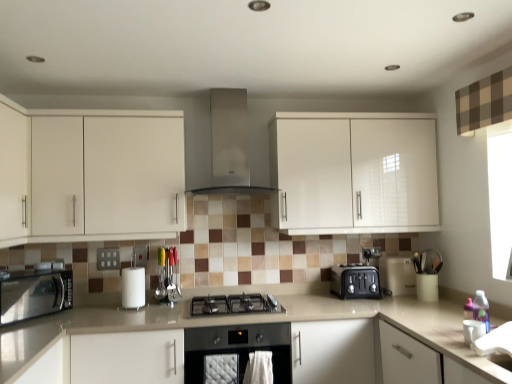
Identify the location of black plastic toaster at right. (397, 275).

At what (x,y) coordinates should I click in order to perform the action: click on beige laminate countertop at center. Please return your answer as a coordinate pair (x, y). Looking at the image, I should click on (251, 322).

Locate an element on the screen. The image size is (512, 384). white matte paper towel at center is located at coordinates (133, 287).

Measure the distance between point (377, 279) and camera.

The distance of point (377, 279) from camera is 9.56 feet.

Where is `satin silver range hood at center, arranged as the first home appliance when viewed from the top`? Image resolution: width=512 pixels, height=384 pixels. satin silver range hood at center, arranged as the first home appliance when viewed from the top is located at coordinates (230, 144).

Looking at this image, considering the relative positions of white glossy cabinet at upper left, the 2th cabinetry from the right, and black stainless steel microwave at lower left, the second kitchen appliance viewed from the right, in the image provided, is white glossy cabinet at upper left, the 2th cabinetry from the right, behind black stainless steel microwave at lower left, the second kitchen appliance viewed from the right,?

That is True.

Image resolution: width=512 pixels, height=384 pixels. In order to click on cabinetry that is the 2nd object above the black stainless steel microwave at lower left, which ranks as the 1th kitchen appliance in left-to-right order (from a real-world perspective) in this screenshot , I will do `click(95, 174)`.

Consider the image. Is white glossy cabinet at upper left, the 2th cabinetry from the right, at the right side of black stainless steel microwave at lower left, which ranks as the second kitchen appliance in back-to-front order?

Correct, you'll find white glossy cabinet at upper left, the 2th cabinetry from the right, to the right of black stainless steel microwave at lower left, which ranks as the second kitchen appliance in back-to-front order.

Looking at this image, from the image's perspective, which object appears higher, white glossy cabinet at upper left, the 2th cabinetry from the right, or black stainless steel microwave at lower left, the 1th kitchen appliance positioned from the front?

From the image's view, white glossy cabinet at upper left, the 2th cabinetry from the right, is above.

From a real-world perspective, which is physically above, stainless steel oven at center, the second home appliance viewed from the top, or satin silver range hood at center, arranged as the first home appliance when viewed from the top?

satin silver range hood at center, arranged as the first home appliance when viewed from the top.

Which of these two, stainless steel oven at center, the second home appliance viewed from the top, or satin silver range hood at center, arranged as the first home appliance when viewed from the top, is wider?

Wider between the two is stainless steel oven at center, the second home appliance viewed from the top.

Considering the positions of objects stainless steel oven at center, the first home appliance ordered from the bottom, and satin silver range hood at center, arranged as the first home appliance when viewed from the top, in the image provided, who is behind, stainless steel oven at center, the first home appliance ordered from the bottom, or satin silver range hood at center, arranged as the first home appliance when viewed from the top,?

satin silver range hood at center, arranged as the first home appliance when viewed from the top, is further away from the camera.

Is point (280, 380) closer or farther from the camera than point (236, 114)?

Clearly, point (280, 380) is closer to the camera than point (236, 114).

Choose the correct answer: Is black plastic toaster at lower center, placed as the 1th kitchen appliance when sorted from right to left, inside brown checkered curtain at upper right or outside it?

black plastic toaster at lower center, placed as the 1th kitchen appliance when sorted from right to left, is outside brown checkered curtain at upper right.

What's the angular difference between black plastic toaster at lower center, placed as the 1th kitchen appliance when sorted from right to left, and brown checkered curtain at upper right's facing directions?

black plastic toaster at lower center, placed as the 1th kitchen appliance when sorted from right to left, and brown checkered curtain at upper right are facing 89.2 degrees away from each other.

From a real-world perspective, which is physically below, black plastic toaster at lower center, placed as the 1th kitchen appliance when sorted from right to left, or brown checkered curtain at upper right?

black plastic toaster at lower center, placed as the 1th kitchen appliance when sorted from right to left.

From a real-world perspective, count 2nd kitchen appliances downward from the brown checkered curtain at upper right and point to it. Please provide its 2D coordinates.

[(355, 282)]

Is brown checkered curtain at upper right outside of satin silver range hood at center, arranged as the first home appliance when viewed from the top?

That's correct, brown checkered curtain at upper right is outside of satin silver range hood at center, arranged as the first home appliance when viewed from the top.

In the scene shown: Is brown checkered curtain at upper right behind satin silver range hood at center, which is the second home appliance in bottom-to-top order?

No, brown checkered curtain at upper right is closer to the viewer.

You are a GUI agent. You are given a task and a screenshot of the screen. Output one action in this format:
    pyautogui.click(x=<x>, y=<y>)
    Task: Click on the 1st home appliance below when counting from the brown checkered curtain at upper right (from the image's perspective)
    The height and width of the screenshot is (384, 512).
    Given the screenshot: What is the action you would take?
    230,144

Is satin silver range hood at center, which is the second home appliance in bottom-to-top order, at the back of brown checkered curtain at upper right?

No, satin silver range hood at center, which is the second home appliance in bottom-to-top order, is not at the back of brown checkered curtain at upper right.

Choose the correct answer: Is matte white switch at center inside white matte paper towel at center or outside it?

matte white switch at center is spatially situated outside white matte paper towel at center.

Which object is further away from the camera taking this photo, matte white switch at center or white matte paper towel at center?

matte white switch at center is more distant.

From a real-world perspective, is matte white switch at center located beneath white matte paper towel at center?

No, from a real-world perspective, matte white switch at center is not below white matte paper towel at center.

Locate an element on the screen. square above the white matte paper towel at center (from the image's perspective) is located at coordinates (108, 259).

Is white glossy cabinet at upper left, the first cabinetry when ordered from left to right, turned away from brown checkered curtain at upper right?

No.

Who is smaller, white glossy cabinet at upper left, the first cabinetry when ordered from left to right, or brown checkered curtain at upper right?

brown checkered curtain at upper right is smaller.

Are white glossy cabinet at upper left, the first cabinetry when ordered from left to right, and brown checkered curtain at upper right located far from each other?

Yes, white glossy cabinet at upper left, the first cabinetry when ordered from left to right, is far from brown checkered curtain at upper right.

Which object is thinner, white glossy cabinet at upper left, the 2th cabinetry from the right, or brown checkered curtain at upper right?

With smaller width is brown checkered curtain at upper right.

Is white matte paper towel at center not within satin silver range hood at center, which is the second home appliance in bottom-to-top order?

Yes, white matte paper towel at center is outside of satin silver range hood at center, which is the second home appliance in bottom-to-top order.

At what (x,y) coordinates should I click in order to perform the action: click on the 1st home appliance in front of the white matte paper towel at center. Please return your answer as a coordinate pair (x, y). Looking at the image, I should click on (230, 144).

From the picture: Who is smaller, white matte paper towel at center or satin silver range hood at center, which is the second home appliance in bottom-to-top order?

Smaller between the two is white matte paper towel at center.

Can you tell me how much white matte paper towel at center and satin silver range hood at center, which is the second home appliance in bottom-to-top order, differ in facing direction?

0.494 degrees.

Where is `the 1st cabinetry above the black stainless steel microwave at lower left, which ranks as the second kitchen appliance in back-to-front order (from the image's perspective)`? The height and width of the screenshot is (384, 512). the 1st cabinetry above the black stainless steel microwave at lower left, which ranks as the second kitchen appliance in back-to-front order (from the image's perspective) is located at coordinates (95, 174).

The width and height of the screenshot is (512, 384). Find the location of `home appliance located behind the stainless steel oven at center, the second home appliance viewed from the top`. home appliance located behind the stainless steel oven at center, the second home appliance viewed from the top is located at coordinates (230, 144).

Based on their spatial positions, is brown checkered curtain at upper right or white glossy cabinet at upper left, the first cabinetry when ordered from left to right, further from beige laminate countertop at center?

The object further to beige laminate countertop at center is brown checkered curtain at upper right.

From the image, which object appears to be farther from white matte paper towel at center, black plastic toaster at right or stainless steel oven at center, the second home appliance viewed from the top?

black plastic toaster at right.

When comparing their distances from brown checkered curtain at upper right, does white glossy cabinet at upper center, which is counted as the 2th cabinetry, starting from the left, or black plastic toaster at right seem closer?

The object closer to brown checkered curtain at upper right is white glossy cabinet at upper center, which is counted as the 2th cabinetry, starting from the left.

Looking at the image, which one is located further to black plastic toaster at right, satin silver range hood at center, arranged as the first home appliance when viewed from the top, or matte white switch at center?

The object further to black plastic toaster at right is matte white switch at center.

Based on their spatial positions, is brown checkered curtain at upper right or black stainless steel gas stove at center closer to matte white switch at center?

black stainless steel gas stove at center.

Consider the image. Considering their positions, is black plastic toaster at lower center, positioned as the 1th kitchen appliance in back-to-front order, positioned further to black stainless steel microwave at lower left, which ranks as the second kitchen appliance in back-to-front order, than white glossy cabinet at upper left, the first cabinetry when ordered from left to right?

black plastic toaster at lower center, positioned as the 1th kitchen appliance in back-to-front order, is further to black stainless steel microwave at lower left, which ranks as the second kitchen appliance in back-to-front order.

Based on their spatial positions, is stainless steel oven at center, the first home appliance ordered from the bottom, or white matte paper towel at center further from black stainless steel microwave at lower left, the 1th kitchen appliance positioned from the front?

The object further to black stainless steel microwave at lower left, the 1th kitchen appliance positioned from the front, is stainless steel oven at center, the first home appliance ordered from the bottom.

Which object lies nearer to the anchor point brown checkered curtain at upper right, white glossy cabinet at upper center, which is counted as the 2th cabinetry, starting from the left, or black plastic toaster at lower center, the second kitchen appliance from the front?

white glossy cabinet at upper center, which is counted as the 2th cabinetry, starting from the left.

Identify the location of paper towel located between black stainless steel microwave at lower left, the 1th kitchen appliance positioned from the front, and white glossy cabinet at upper center, which is counted as the 2th cabinetry, starting from the left, in the left-right direction. (133, 287).

Locate an element on the screen. This screenshot has width=512, height=384. appliance between brown checkered curtain at upper right and black plastic toaster at lower center, positioned as the 1th kitchen appliance in back-to-front order, in the vertical direction is located at coordinates (397, 275).

At what (x,y) coordinates should I click in order to perform the action: click on gas stove between matte white switch at center and black plastic toaster at lower center, positioned as the 1th kitchen appliance in back-to-front order. Please return your answer as a coordinate pair (x, y). Looking at the image, I should click on (234, 304).

Find the location of a particular element. Image resolution: width=512 pixels, height=384 pixels. gas stove between white glossy cabinet at upper left, the first cabinetry when ordered from left to right, and stainless steel oven at center, the first home appliance ordered from the bottom, from top to bottom is located at coordinates (234, 304).